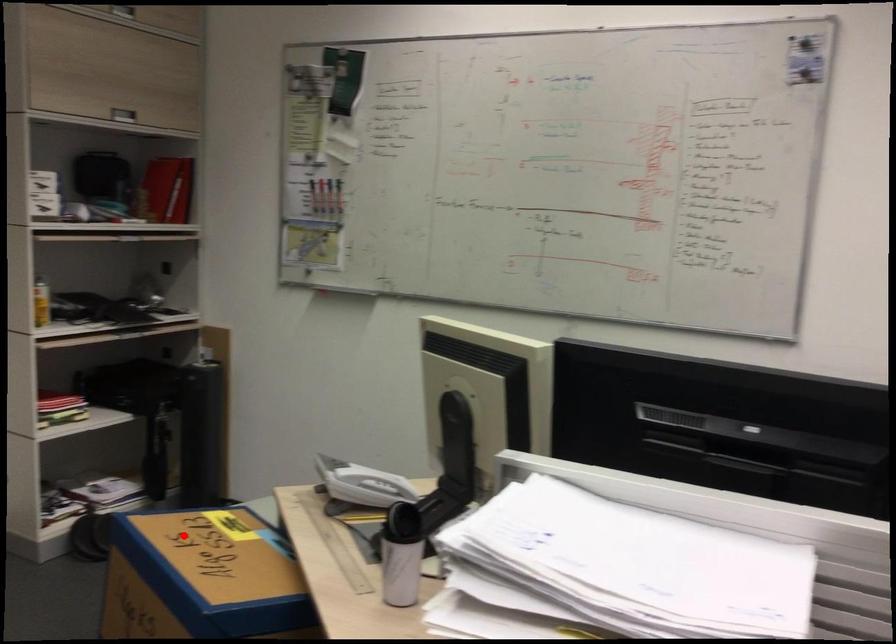
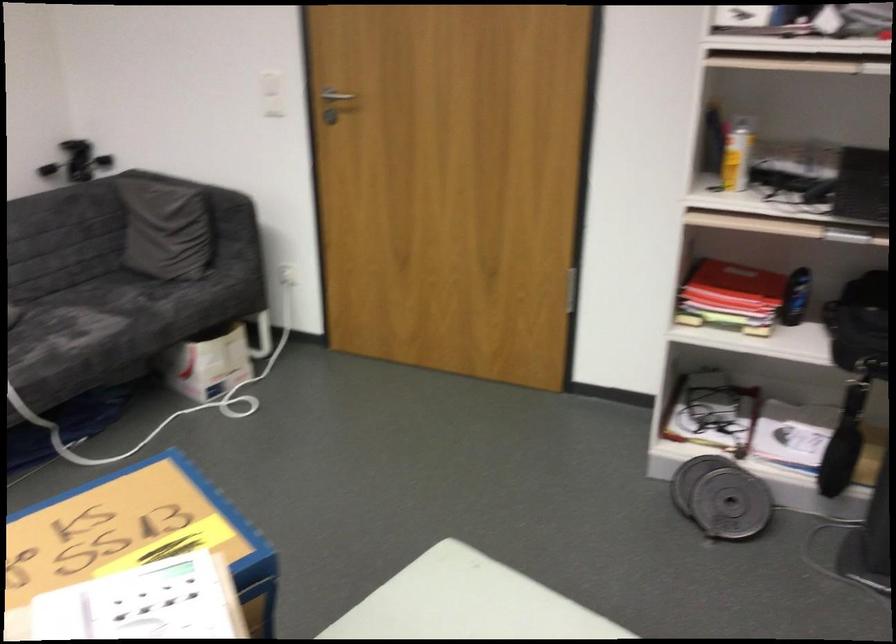
Find the pixel in the second image that matches the highlighted location in the first image.

(139, 535)